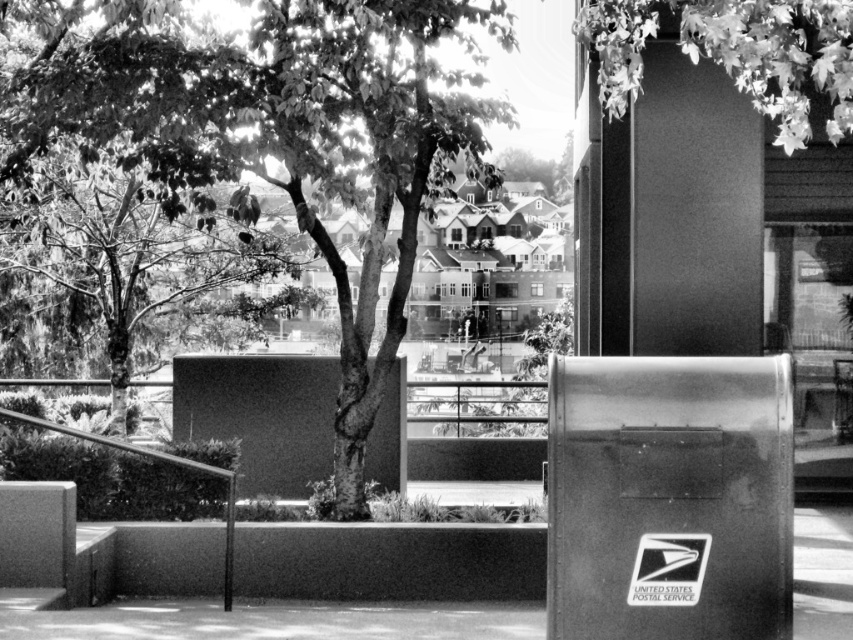
Question: Which object appears farthest from the camera in this image?

Choices:
 (A) smooth concrete pavement at lower center
 (B) smooth green tree at center
 (C) smooth green tree at upper left

Answer: (C)

Question: Can you confirm if smooth green tree at center is positioned to the right of smooth concrete pavement at lower center?

Choices:
 (A) no
 (B) yes

Answer: (A)

Question: Which is farther from the leaves at upper right?

Choices:
 (A) smooth concrete pavement at lower center
 (B) smooth green tree at upper left
 (C) smooth green tree at center

Answer: (B)

Question: Is smooth green tree at upper left positioned behind leaves at upper right?

Choices:
 (A) no
 (B) yes

Answer: (B)

Question: Which point is closer to the camera?

Choices:
 (A) (292, 269)
 (B) (112, 618)
 (C) (384, 342)

Answer: (B)

Question: Does smooth green tree at upper left appear over smooth concrete pavement at lower center?

Choices:
 (A) no
 (B) yes

Answer: (B)